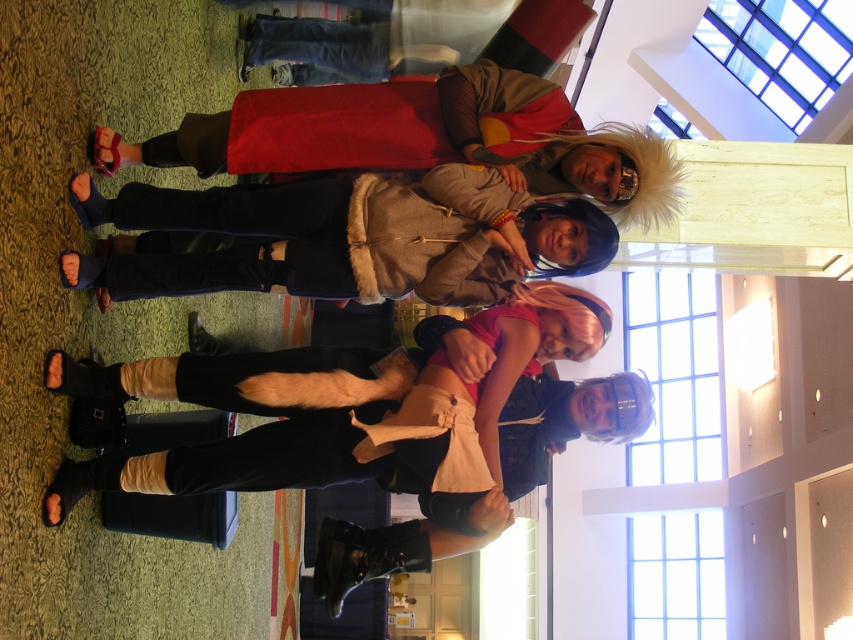
Between velvet-like red cape at upper center and fur-lined jacket at center, which one appears on the left side from the viewer's perspective?

fur-lined jacket at center

Can you confirm if velvet-like red cape at upper center is positioned to the left of fur-lined jacket at center?

In fact, velvet-like red cape at upper center is to the right of fur-lined jacket at center.

Which is behind, point (428, 109) or point (279, 284)?

The point (428, 109) is behind.

Find the location of `velvet-like red cape at upper center`. velvet-like red cape at upper center is located at coordinates (425, 138).